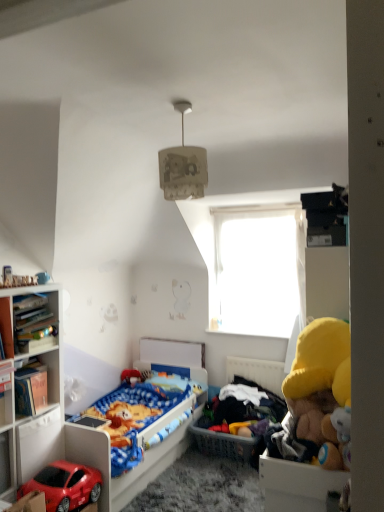
Locate an element on the screen. shiny red toy car at lower left is located at coordinates (65, 486).

This screenshot has width=384, height=512. What do you see at coordinates (65, 486) in the screenshot? I see `shiny red toy car at lower left` at bounding box center [65, 486].

At what (x,y) coordinates should I click in order to perform the action: click on white paper lampshade at upper center. Please return your answer as a coordinate pair (x, y). This screenshot has height=512, width=384. Looking at the image, I should click on (183, 165).

What do you see at coordinates (258, 269) in the screenshot? I see `transparent plastic window at upper center` at bounding box center [258, 269].

Looking at this image, in order to face matte plastic bed at lower left, should I rotate leftwards or rightwards?

A 8.811 degree turn to the left will do.

What do you see at coordinates (141, 455) in the screenshot?
I see `matte plastic bed at lower left` at bounding box center [141, 455].

What is the approximate height of wooden toy chest at lower right, which is the 1th cabinet in front-to-back order?

wooden toy chest at lower right, which is the 1th cabinet in front-to-back order, is 9.31 inches tall.

Identify the location of shiny red toy car at lower left. This screenshot has width=384, height=512. (65, 486).

Considering the sizes of objects matte white bookcase at left and white paper lampshade at upper center in the image provided, who is wider, matte white bookcase at left or white paper lampshade at upper center?

With larger width is matte white bookcase at left.

Would you say matte white bookcase at left is inside or outside white paper lampshade at upper center?

matte white bookcase at left is spatially situated outside white paper lampshade at upper center.

Locate an element on the screen. lamp that appears in front of the matte white bookcase at left is located at coordinates tap(183, 165).

Which of these two, shiny red toy car at lower left or white paper lampshade at upper center, is bigger?

shiny red toy car at lower left is bigger.

Is shiny red toy car at lower left in contact with white paper lampshade at upper center?

No.

From the image's perspective, is shiny red toy car at lower left located beneath white paper lampshade at upper center?

Yes.

Is transparent plastic window at upper center oriented towards matte white bookcase at left?

Yes, transparent plastic window at upper center is aimed at matte white bookcase at left.

Between transparent plastic window at upper center and matte white bookcase at left, which one appears on the left side from the viewer's perspective?

matte white bookcase at left is more to the left.

From the image's perspective, which is below, transparent plastic window at upper center or matte white bookcase at left?

matte white bookcase at left.

Are matte white bookshelf at left, arranged as the first cabinet when viewed from the back, and transparent plastic window at upper center far apart?

Indeed, matte white bookshelf at left, arranged as the first cabinet when viewed from the back, is not near transparent plastic window at upper center.

This screenshot has width=384, height=512. I want to click on window positioned vertically above the matte white bookshelf at left, positioned as the 1th cabinet in left-to-right order (from a real-world perspective), so click(x=258, y=269).

In terms of height, does matte white bookshelf at left, positioned as the 1th cabinet in left-to-right order, look taller or shorter compared to transparent plastic window at upper center?

Considering their sizes, matte white bookshelf at left, positioned as the 1th cabinet in left-to-right order, has less height than transparent plastic window at upper center.

From a real-world perspective, is white paper lampshade at upper center on shiny red toy car at lower left?

Indeed, from a real-world perspective, white paper lampshade at upper center stands above shiny red toy car at lower left.

What are the coordinates of `lamp located in front of the shiny red toy car at lower left` in the screenshot? It's located at (183, 165).

From the image's perspective, is white paper lampshade at upper center located beneath shiny red toy car at lower left?

No, from the image's perspective, white paper lampshade at upper center is not beneath shiny red toy car at lower left.

Can you tell me how much white paper lampshade at upper center and shiny red toy car at lower left differ in facing direction?

The angular difference between white paper lampshade at upper center and shiny red toy car at lower left is 0.404 degrees.

From a real-world perspective, between white paper lampshade at upper center and matte white bookshelf at left, the 3th cabinet viewed from the front, who is vertically higher?

white paper lampshade at upper center, from a real-world perspective.

From the image's perspective, is white paper lampshade at upper center on matte white bookshelf at left, arranged as the first cabinet when viewed from the back?

Indeed, from the image's perspective, white paper lampshade at upper center is shown above matte white bookshelf at left, arranged as the first cabinet when viewed from the back.

Between white paper lampshade at upper center and matte white bookshelf at left, positioned as the 1th cabinet in left-to-right order, which one has more height?

With more height is white paper lampshade at upper center.

Is white paper lampshade at upper center completely or partially outside of wooden bookshelf at left, which is counted as the second cabinet, starting from the back?

white paper lampshade at upper center is positioned outside wooden bookshelf at left, which is counted as the second cabinet, starting from the back.

Does white paper lampshade at upper center turn towards wooden bookshelf at left, the second cabinet when ordered from left to right?

No, white paper lampshade at upper center is not facing towards wooden bookshelf at left, the second cabinet when ordered from left to right.

In the image, is white paper lampshade at upper center positioned in front of or behind wooden bookshelf at left, which is counted as the second cabinet, starting from the back?

white paper lampshade at upper center is positioned closer to the viewer than wooden bookshelf at left, which is counted as the second cabinet, starting from the back.

From a real-world perspective, who is located lower, white paper lampshade at upper center or wooden bookshelf at left, the second cabinet when ordered from left to right?

From a 3D spatial view, wooden bookshelf at left, the second cabinet when ordered from left to right, is below.

This screenshot has height=512, width=384. I want to click on lamp to the right of matte white bookcase at left, so click(183, 165).

Find the location of a particular element. car below the white paper lampshade at upper center (from a real-world perspective) is located at coordinates (65, 486).

When comparing their distances from transparent plastic window at upper center, does wooden bookshelf at left, which ranks as the 2th cabinet in right-to-left order, or wooden toy chest at lower right, marked as the first cabinet in a right-to-left arrangement, seem closer?

wooden bookshelf at left, which ranks as the 2th cabinet in right-to-left order, lies closer to transparent plastic window at upper center than the other object.

Considering their positions, is plastic basket at center positioned closer to wooden toy chest at lower right, marked as the first cabinet in a right-to-left arrangement, than white paper lampshade at upper center?

Based on the image, white paper lampshade at upper center appears to be nearer to wooden toy chest at lower right, marked as the first cabinet in a right-to-left arrangement.

When comparing their distances from shiny red toy car at lower left, does white paper lampshade at upper center or transparent plastic window at upper center seem closer?

white paper lampshade at upper center is closer to shiny red toy car at lower left.

Looking at the image, which one is located further to matte plastic bed at lower left, transparent plastic window at upper center or wooden bookshelf at left, which ranks as the 2th cabinet in right-to-left order?

transparent plastic window at upper center is further to matte plastic bed at lower left.

Looking at the image, which one is located closer to matte white bookshelf at left, the 3th cabinet viewed from the front, wooden toy chest at lower right, marked as the first cabinet in a right-to-left arrangement, or white paper lampshade at upper center?

white paper lampshade at upper center is closer to matte white bookshelf at left, the 3th cabinet viewed from the front.

Considering their positions, is wooden bookshelf at left, which is counted as the second cabinet, starting from the back, positioned further to matte white bookshelf at left, arranged as the first cabinet when viewed from the back, than matte white bookcase at left?

wooden bookshelf at left, which is counted as the second cabinet, starting from the back, lies further to matte white bookshelf at left, arranged as the first cabinet when viewed from the back, than the other object.

Looking at the image, which one is located further to wooden bookshelf at left, which is counted as the second cabinet, starting from the back, shiny red toy car at lower left or matte plastic bed at lower left?

The object further to wooden bookshelf at left, which is counted as the second cabinet, starting from the back, is matte plastic bed at lower left.

Estimate the real-world distances between objects in this image. Which object is closer to white paper lampshade at upper center, shiny red toy car at lower left or transparent plastic window at upper center?

Based on the image, shiny red toy car at lower left appears to be nearer to white paper lampshade at upper center.

Find the location of `bookcase between matte white bookshelf at left, the 3th cabinet viewed from the front, and shiny red toy car at lower left in the up-down direction`. bookcase between matte white bookshelf at left, the 3th cabinet viewed from the front, and shiny red toy car at lower left in the up-down direction is located at coordinates (47, 383).

Locate an element on the screen. The width and height of the screenshot is (384, 512). bed between wooden toy chest at lower right, arranged as the 3th cabinet when viewed from the back, and plastic basket at center from front to back is located at coordinates tap(141, 455).

Identify the location of car located between wooden toy chest at lower right, which is the 1th cabinet in front-to-back order, and plastic basket at center in the depth direction. (65, 486).

The height and width of the screenshot is (512, 384). I want to click on lamp between matte white bookshelf at left, the 3th cabinet viewed from the right, and wooden toy chest at lower right, arranged as the 3th cabinet when viewed from the back, from left to right, so click(183, 165).